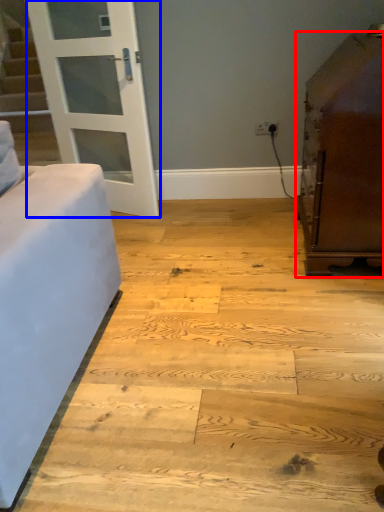
Question: Which object is further to the camera taking this photo, furniture (highlighted by a red box) or door (highlighted by a blue box)?

Choices:
 (A) furniture
 (B) door

Answer: (B)